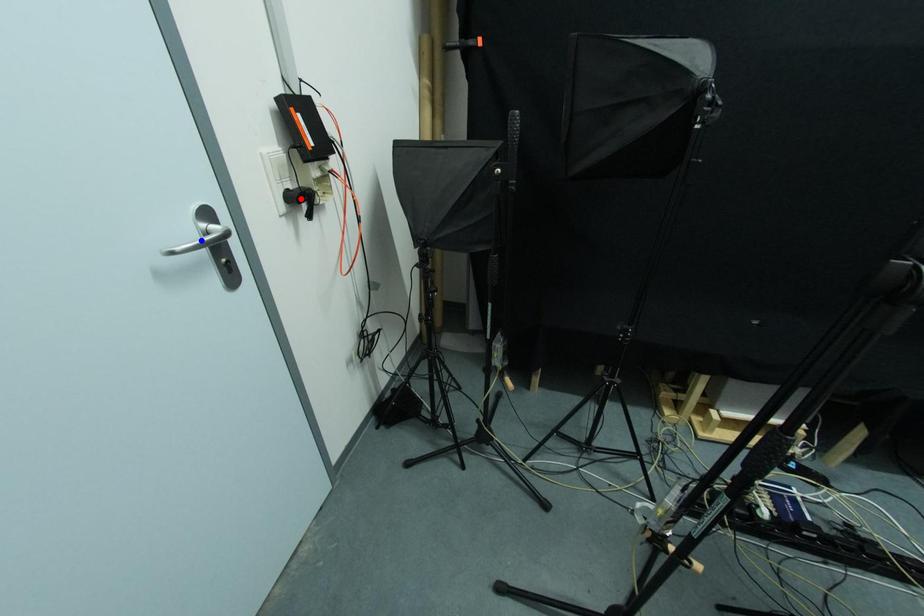
Question: Two points are marked on the image. Which point is closer to the camera?

Choices:
 (A) Blue point is closer.
 (B) Red point is closer.

Answer: (A)